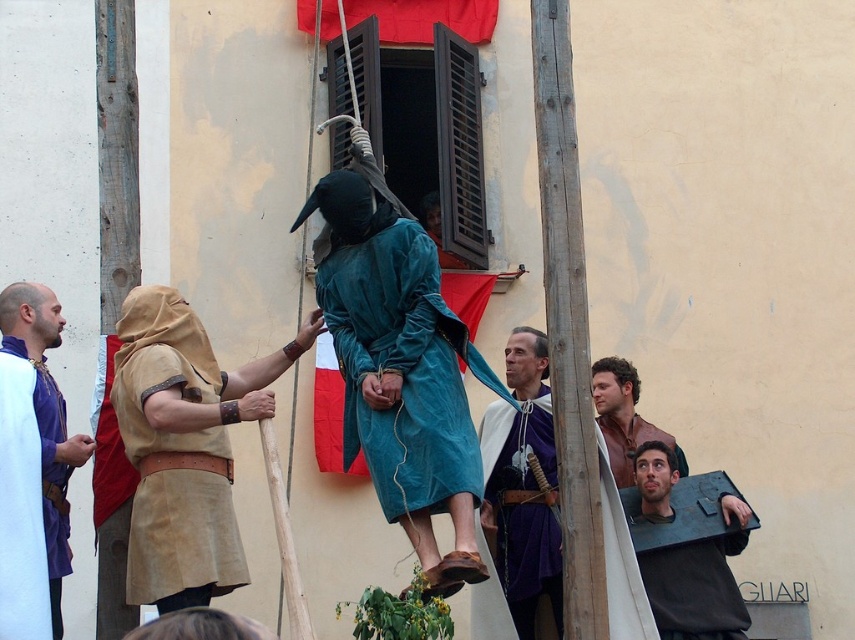
You are an archer positioned at the center of the image. You need to aim at the dark gray leather shield at lower right. What are the coordinates of the shield to ensure accurate targeting?

The coordinates of the dark gray leather shield at lower right are at point [699,580].

Based on the scene description, which object is taller when comparing the wooden pole at center and the matte blue robe at center?

The wooden pole at center is taller than the matte blue robe at center according to the description.